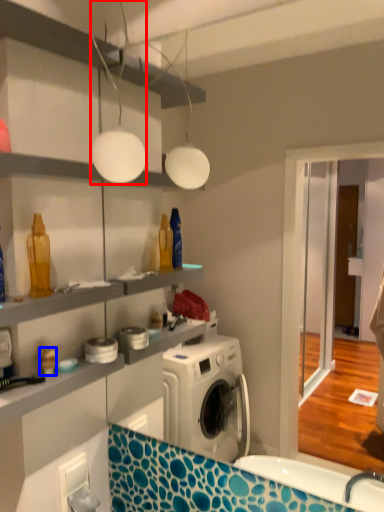
Question: Among these objects, which one is nearest to the camera, light fixture (highlighted by a red box) or toy (highlighted by a blue box)?

Choices:
 (A) light fixture
 (B) toy

Answer: (A)